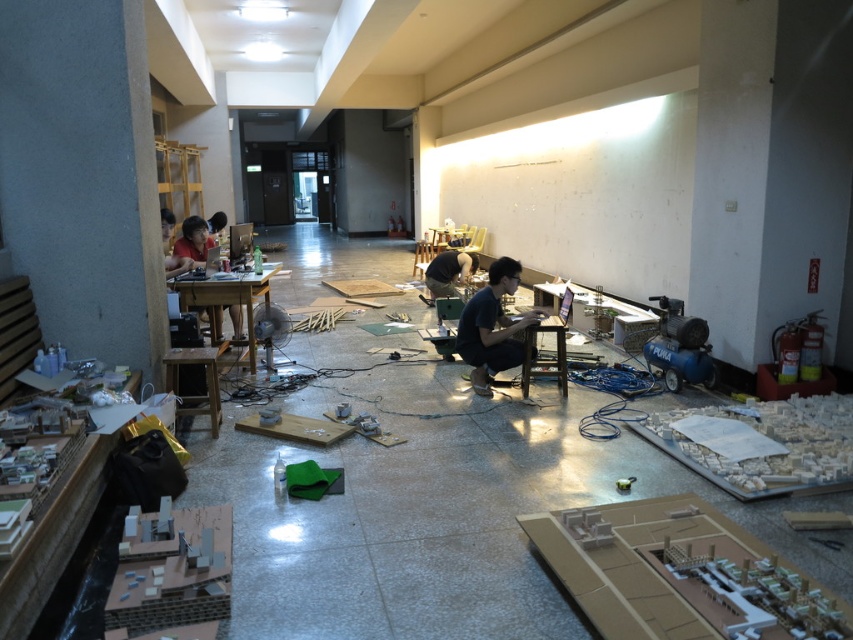
Measure the distance between point (485, 312) and camera.

They are 14.89 feet apart.

Does dark blue shirt at center appear over matte black shirt at center?

Actually, dark blue shirt at center is below matte black shirt at center.

Measure the distance between point (509, 321) and camera.

They are 15.46 feet apart.

Locate an element on the screen. dark blue shirt at center is located at coordinates (492, 326).

Can you confirm if dark blue shirt at center is thinner than matte black shirt at left?

No, dark blue shirt at center is not thinner than matte black shirt at left.

Who is more distant from viewer, (498, 337) or (218, 308)?

Point (218, 308)

Is point (503, 291) more distant than point (189, 224)?

No, (503, 291) is closer to viewer.

I want to click on dark blue shirt at center, so click(492, 326).

Is matte black shirt at center closer to the viewer compared to matte black shirt at upper left?

No, it is not.

Which is more to the left, matte black shirt at center or matte black shirt at upper left?

Positioned to the left is matte black shirt at upper left.

Where is `matte black shirt at center`? matte black shirt at center is located at coordinates pos(448,273).

This screenshot has width=853, height=640. What are the coordinates of `matte black shirt at center` in the screenshot? It's located at (448, 273).